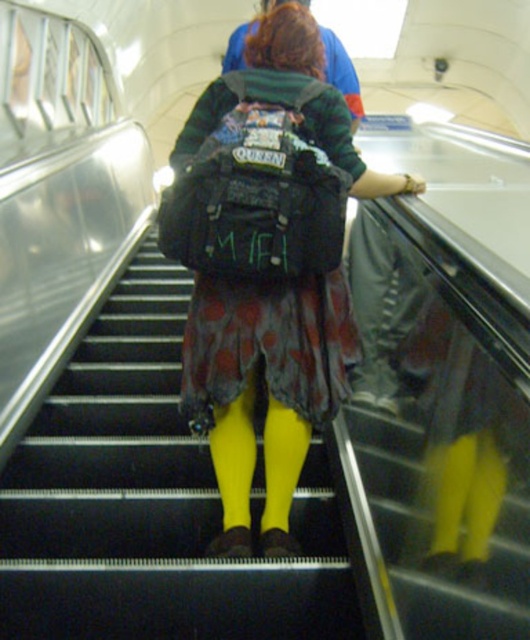
Between matte black backpack at center and leather at right, which one has less height?

leather at right is shorter.

What do you see at coordinates (267, 264) in the screenshot?
I see `matte black backpack at center` at bounding box center [267, 264].

Where is `matte black backpack at center`? matte black backpack at center is located at coordinates (267, 264).

Is point (120, 369) less distant than point (304, 305)?

No, it is not.

Does yellow fabric stairs at center lie in front of matte black backpack at center?

No, yellow fabric stairs at center is behind matte black backpack at center.

Where is `yellow fabric stairs at center`? yellow fabric stairs at center is located at coordinates (149, 500).

How distant is yellow fabric stairs at center from leather at right?

yellow fabric stairs at center and leather at right are 28.82 inches apart.

Can you confirm if yellow fabric stairs at center is shorter than leather at right?

Yes.

Is point (93, 394) closer to viewer compared to point (387, 348)?

No, it is behind (387, 348).

At what (x,y) coordinates should I click in order to perform the action: click on yellow fabric stairs at center. Please return your answer as a coordinate pair (x, y). The image size is (530, 640). Looking at the image, I should click on (149, 500).